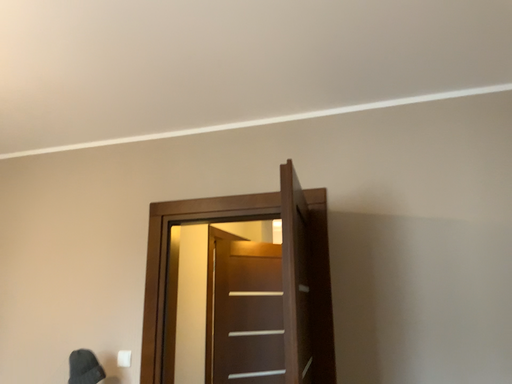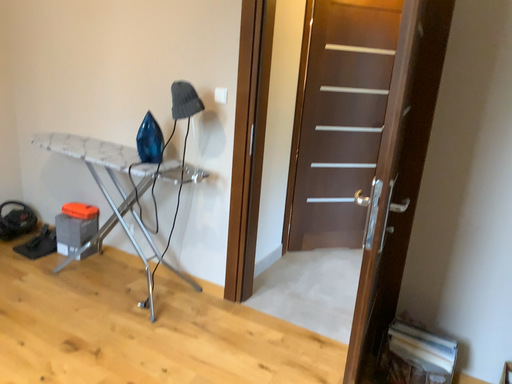
Question: Which way did the camera rotate in the video?

Choices:
 (A) rotated downward
 (B) rotated upward

Answer: (A)